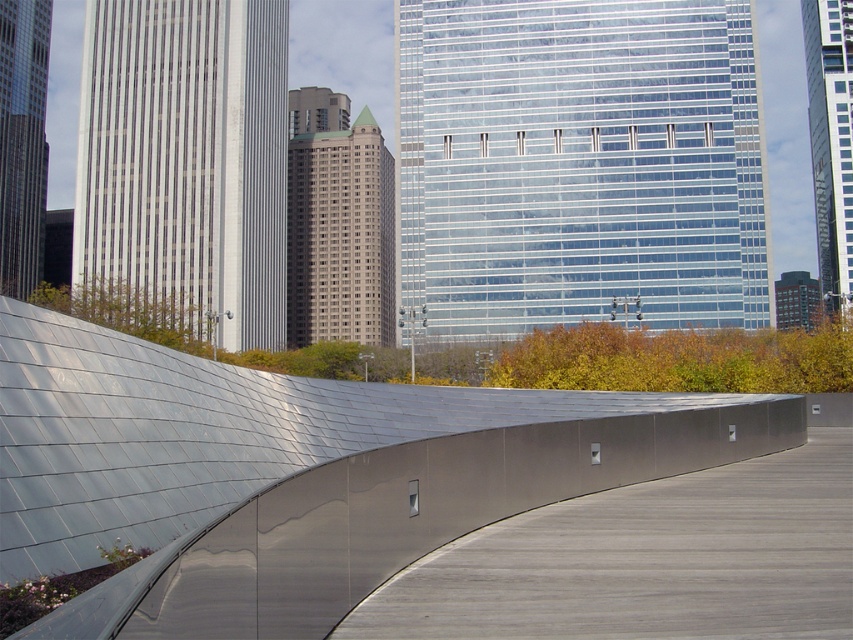
Question: Which object appears farthest from the camera in this image?

Choices:
 (A) satin silver wall at center
 (B) silver metallic ramp at center

Answer: (A)

Question: Which object appears farthest from the camera in this image?

Choices:
 (A) silver metallic ramp at center
 (B) satin silver wall at center

Answer: (B)

Question: Considering the relative positions of silver metallic ramp at center and satin silver wall at center in the image provided, where is silver metallic ramp at center located with respect to satin silver wall at center?

Choices:
 (A) right
 (B) left

Answer: (B)

Question: Does silver metallic ramp at center appear on the right side of satin silver wall at center?

Choices:
 (A) no
 (B) yes

Answer: (A)

Question: Is silver metallic ramp at center bigger than satin silver wall at center?

Choices:
 (A) no
 (B) yes

Answer: (B)